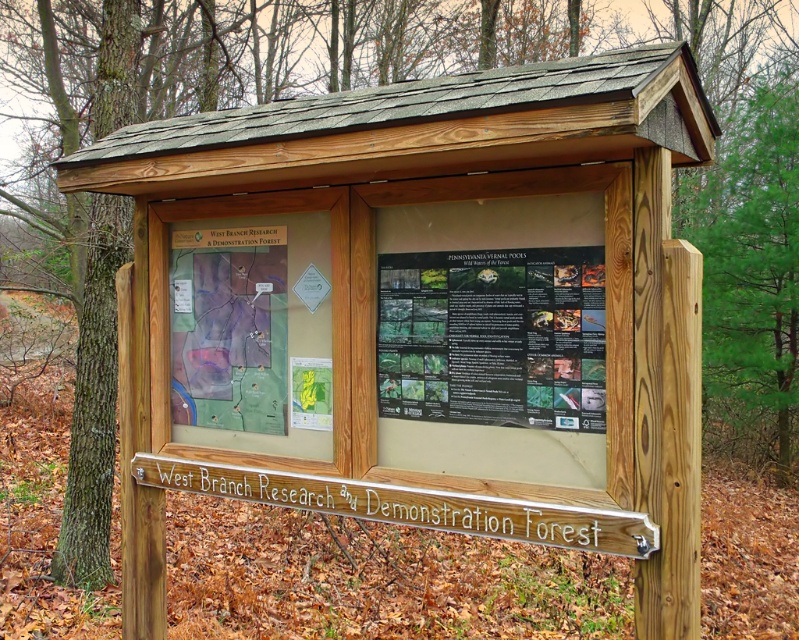
Is black paper poster at center below transparent plastic map at center?

Yes.

Who is positioned more to the right, black paper poster at center or transparent plastic map at center?

black paper poster at center

Who is more distant from viewer, (499, 280) or (229, 376)?

The point (229, 376) is more distant.

You are a GUI agent. You are given a task and a screenshot of the screen. Output one action in this format:
    pyautogui.click(x=<x>, y=<y>)
    Task: Click on the black paper poster at center
    This screenshot has width=799, height=640.
    Given the screenshot: What is the action you would take?
    pyautogui.click(x=493, y=337)